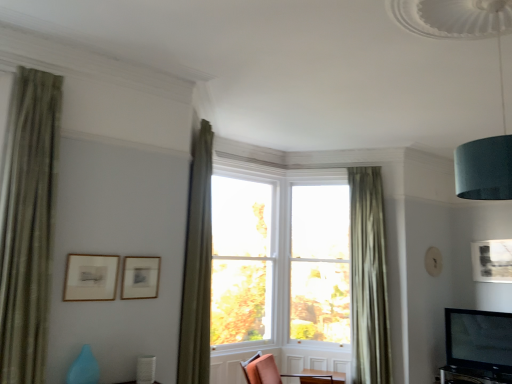
Question: From a real-world perspective, is clear glass window at center on top of green textured curtain at left, which is the 1th curtain from left to right?

Choices:
 (A) yes
 (B) no

Answer: (B)

Question: Is clear glass window at center closer to camera compared to green textured curtain at left, marked as the third curtain in a right-to-left arrangement?

Choices:
 (A) yes
 (B) no

Answer: (B)

Question: Can you confirm if clear glass window at center is bigger than green textured curtain at left, marked as the third curtain in a right-to-left arrangement?

Choices:
 (A) no
 (B) yes

Answer: (B)

Question: Considering the relative positions of clear glass window at center and green textured curtain at left, which is the 1th curtain from left to right, in the image provided, is clear glass window at center to the right of green textured curtain at left, which is the 1th curtain from left to right, from the viewer's perspective?

Choices:
 (A) yes
 (B) no

Answer: (A)

Question: Is clear glass window at center taller than green textured curtain at left, which is the 1th curtain from left to right?

Choices:
 (A) no
 (B) yes

Answer: (B)

Question: From a real-world perspective, is clear glass window at center below green textured curtain at left, which is the 1th curtain from left to right?

Choices:
 (A) no
 (B) yes

Answer: (B)

Question: Can you confirm if matte wooden picture frame at upper left, which ranks as the 1th picture frame in left-to-right order, is positioned to the left of green textured curtain at upper center, which appears as the second curtain when viewed from the left?

Choices:
 (A) no
 (B) yes

Answer: (B)

Question: Does matte wooden picture frame at upper left, which appears as the 3th picture frame when viewed from the back, have a lesser height compared to green textured curtain at upper center, acting as the 2th curtain starting from the back?

Choices:
 (A) no
 (B) yes

Answer: (B)

Question: Can you confirm if matte wooden picture frame at upper left, the first picture frame from the front, is taller than green textured curtain at upper center, acting as the 2th curtain starting from the back?

Choices:
 (A) yes
 (B) no

Answer: (B)

Question: Is matte wooden picture frame at upper left, which appears as the 3th picture frame when viewed from the back, positioned with its back to green textured curtain at upper center, which is counted as the 2th curtain, starting from the right?

Choices:
 (A) no
 (B) yes

Answer: (A)

Question: Is green textured curtain at upper center, which appears as the second curtain when viewed from the left, a part of matte wooden picture frame at upper left, which is the third picture frame in right-to-left order?

Choices:
 (A) yes
 (B) no

Answer: (B)

Question: Is matte wooden picture frame at upper left, which appears as the 3th picture frame when viewed from the back, oriented towards green textured curtain at upper center, which appears as the 2th curtain when viewed from the front?

Choices:
 (A) no
 (B) yes

Answer: (A)

Question: Does green textured curtain at left, which is the 1th curtain from left to right, lie in front of matte orange chair at center?

Choices:
 (A) no
 (B) yes

Answer: (B)